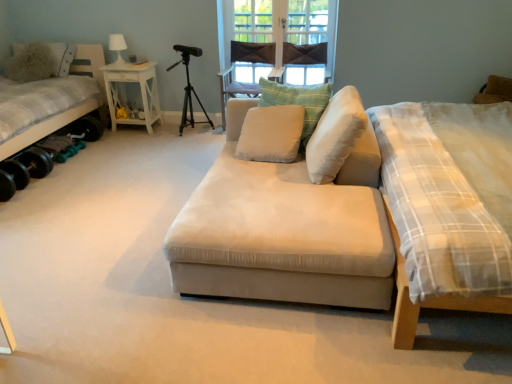
Locate an element on the screen. The height and width of the screenshot is (384, 512). black matte tripod at center is located at coordinates (190, 99).

How much space does white soft cushion at center, which is counted as the 1th pillow, starting from the front, occupy horizontally?

37.75 centimeters.

Describe the element at coordinates (335, 135) in the screenshot. I see `white soft cushion at center, which is counted as the 1th pillow, starting from the front` at that location.

This screenshot has height=384, width=512. Describe the element at coordinates (35, 62) in the screenshot. I see `fuzzy fabric pillow at upper left, placed as the fourth pillow when sorted from front to back` at that location.

Where is `plaid fabric mattress at right`? plaid fabric mattress at right is located at coordinates (449, 193).

Which object is more forward, dark fabric window screen at center or fuzzy fabric pillow at upper left, placed as the fourth pillow when sorted from front to back?

fuzzy fabric pillow at upper left, placed as the fourth pillow when sorted from front to back, is closer to the camera.

How different are the orientations of dark fabric window screen at center and fuzzy fabric pillow at upper left, placed as the first pillow when sorted from back to front, in degrees?

They differ by 0.881 degrees in their facing directions.

From the image's perspective, is dark fabric window screen at center positioned above or below fuzzy fabric pillow at upper left, placed as the first pillow when sorted from back to front?

Clearly, from the image's perspective, dark fabric window screen at center is above fuzzy fabric pillow at upper left, placed as the first pillow when sorted from back to front.

Is dark fabric window screen at center facing away from fuzzy fabric pillow at upper left, placed as the first pillow when sorted from back to front?

That's not correct — dark fabric window screen at center is not looking away from fuzzy fabric pillow at upper left, placed as the first pillow when sorted from back to front.

Is black matte tripod at center wider or thinner than white soft cushion at center, marked as the 2th pillow in a left-to-right arrangement?

In the image, black matte tripod at center appears to be more narrow than white soft cushion at center, marked as the 2th pillow in a left-to-right arrangement.

Considering the relative sizes of black matte tripod at center and white soft cushion at center, marked as the 2th pillow in a left-to-right arrangement, in the image provided, is black matte tripod at center bigger than white soft cushion at center, marked as the 2th pillow in a left-to-right arrangement,?

Yes, black matte tripod at center is bigger than white soft cushion at center, marked as the 2th pillow in a left-to-right arrangement.

Is black matte tripod at center next to white soft cushion at center, marked as the 2th pillow in a left-to-right arrangement?

No, black matte tripod at center is not making contact with white soft cushion at center, marked as the 2th pillow in a left-to-right arrangement.

This screenshot has width=512, height=384. What are the coordinates of `tripod behind the white soft cushion at center, marked as the third pillow in a right-to-left arrangement` in the screenshot? It's located at (190, 99).

What are the coordinates of `pillow that is the 1st object located behind the beige fabric couch at center` in the screenshot? It's located at click(335, 135).

Is beige fabric couch at center not close to white soft cushion at center, which is the fourth pillow from left to right?

They are positioned close to each other.

In terms of size, does beige fabric couch at center appear bigger or smaller than white soft cushion at center, which appears as the 4th pillow when viewed from the back?

beige fabric couch at center is bigger than white soft cushion at center, which appears as the 4th pillow when viewed from the back.

From a real-world perspective, is beige fabric couch at center positioned above or below white soft cushion at center, which appears as the 4th pillow when viewed from the back?

beige fabric couch at center is below white soft cushion at center, which appears as the 4th pillow when viewed from the back.

Can you confirm if dark fabric window screen at center is bigger than white matte table lamp at upper left?

Correct, dark fabric window screen at center is larger in size than white matte table lamp at upper left.

Would you say dark fabric window screen at center is to the left or to the right of white matte table lamp at upper left in the picture?

dark fabric window screen at center is positioned on white matte table lamp at upper left's right side.

Which is less distant, [251,8] or [114,39]?

The point [114,39] is more forward.

Is point (297, 0) positioned after point (242, 45)?

No, it is in front of (242, 45).

Can you confirm if dark fabric window screen at center is thinner than light beige fabric armchair at center?

Yes.

Based on their positions, is dark fabric window screen at center located to the left or right of light beige fabric armchair at center?

dark fabric window screen at center is to the right of light beige fabric armchair at center.

Would you say dark fabric window screen at center is inside or outside light beige fabric armchair at center?

dark fabric window screen at center is spatially situated outside light beige fabric armchair at center.

Is beige fabric couch at center in front of or behind fuzzy fabric pillow at upper left, marked as the 1th pillow in a left-to-right arrangement, in the image?

beige fabric couch at center is positioned closer to the viewer than fuzzy fabric pillow at upper left, marked as the 1th pillow in a left-to-right arrangement.

Is beige fabric couch at center bigger or smaller than fuzzy fabric pillow at upper left, marked as the 4th pillow in a right-to-left arrangement?

Considering their sizes, beige fabric couch at center takes up more space than fuzzy fabric pillow at upper left, marked as the 4th pillow in a right-to-left arrangement.

Visually, is beige fabric couch at center positioned to the left or to the right of fuzzy fabric pillow at upper left, placed as the fourth pillow when sorted from front to back?

Clearly, beige fabric couch at center is on the right of fuzzy fabric pillow at upper left, placed as the fourth pillow when sorted from front to back, in the image.

Locate an element on the screen. The image size is (512, 384). pillow that is the 4th one above the beige fabric couch at center (from a real-world perspective) is located at coordinates (35, 62).

The image size is (512, 384). Identify the location of table lamp located on the right of white fabric bed at left. point(118,50).

Does white fabric bed at left lie in front of white matte table lamp at upper left?

Yes, it is.

How far apart are white fabric bed at left and white matte table lamp at upper left?

They are 22.57 inches apart.

The image size is (512, 384). In order to click on window screen to the right of fuzzy fabric pillow at upper left, placed as the first pillow when sorted from back to front in this screenshot , I will do `click(306, 22)`.

The image size is (512, 384). Find the location of `the 2nd pillow below the black matte tripod at center (from the image's perspective)`. the 2nd pillow below the black matte tripod at center (from the image's perspective) is located at coordinates (271, 134).

From the image, which object appears to be nearer to fuzzy fabric pillow at upper left, placed as the first pillow when sorted from back to front, beige fabric couch at center or black matte tripod at center?

black matte tripod at center lies closer to fuzzy fabric pillow at upper left, placed as the first pillow when sorted from back to front, than the other object.

Looking at the image, which one is located further to beige fabric couch at center, white fabric bed at left or fuzzy fabric pillow at upper left, placed as the first pillow when sorted from back to front?

fuzzy fabric pillow at upper left, placed as the first pillow when sorted from back to front, is further to beige fabric couch at center.

From the image, which object appears to be nearer to white matte table lamp at upper left, fuzzy fabric pillow at upper left, marked as the 1th pillow in a left-to-right arrangement, or light beige fabric armchair at center?

fuzzy fabric pillow at upper left, marked as the 1th pillow in a left-to-right arrangement, is closer to white matte table lamp at upper left.

Based on their spatial positions, is light beige fabric armchair at center or white fabric bed at left closer to white soft cushion at center, the 2th pillow in the right-to-left sequence?

Among the two, light beige fabric armchair at center is located nearer to white soft cushion at center, the 2th pillow in the right-to-left sequence.

Consider the image. From the image, which object appears to be nearer to white fabric bed at left, beige fabric couch at center or dark fabric window screen at center?

dark fabric window screen at center is positioned closer to the anchor white fabric bed at left.

Based on their spatial positions, is beige fabric couch at center or white wood side table at left closer to white soft cushion at center, the 2th pillow in the right-to-left sequence?

beige fabric couch at center is positioned closer to the anchor white soft cushion at center, the 2th pillow in the right-to-left sequence.

Considering their positions, is fuzzy fabric pillow at upper left, marked as the 4th pillow in a right-to-left arrangement, positioned further to dark fabric window screen at center than light beige fabric armchair at center?

fuzzy fabric pillow at upper left, marked as the 4th pillow in a right-to-left arrangement.

Looking at the image, which one is located further to light beige fabric armchair at center, plaid fabric mattress at right or white soft cushion at center, acting as the second pillow starting from the back?

The object further to light beige fabric armchair at center is plaid fabric mattress at right.

Locate an element on the screen. The height and width of the screenshot is (384, 512). pillow between white fabric bed at left and light beige fabric armchair at center from left to right is located at coordinates (35, 62).

I want to click on tripod positioned between white soft cushion at center, acting as the second pillow starting from the back, and light beige fabric armchair at center from near to far, so click(190, 99).

Identify the location of pillow between white soft cushion at center, marked as the 2th pillow in a left-to-right arrangement, and light beige fabric armchair at center from front to back. (298, 102).

Identify the location of nightstand between white soft cushion at center, the third pillow viewed from the left, and dark fabric window screen at center, along the z-axis. The height and width of the screenshot is (384, 512). (140, 91).